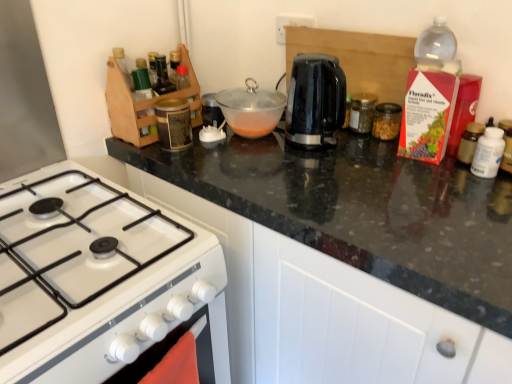
In order to click on blank space to the left of translucent plastic bottle at right, which is the 1th kitchen appliance from right to left in this screenshot , I will do `click(406, 167)`.